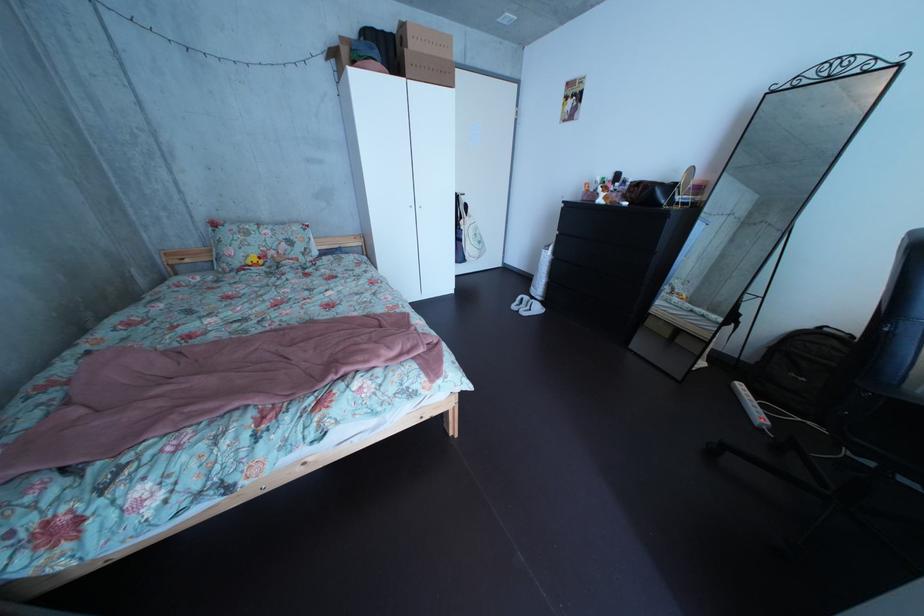
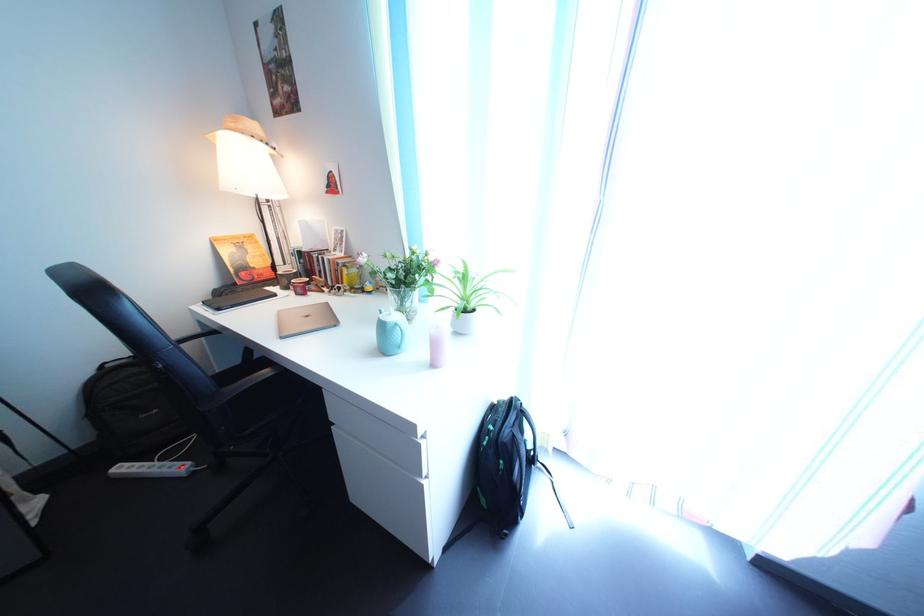
Based on the continuous images, in which direction is the camera rotating?

The rotation direction of the camera is right-down.